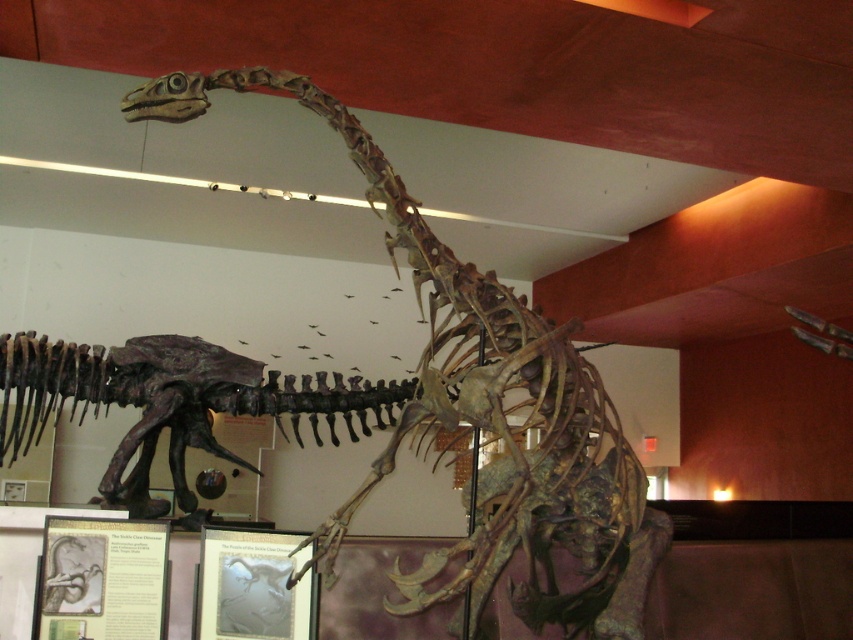
Can you confirm if brown bone-like dinosaur at center is positioned below shiny metallic dinosaur skeleton at center?

Incorrect, brown bone-like dinosaur at center is not positioned below shiny metallic dinosaur skeleton at center.

What do you see at coordinates (485, 413) in the screenshot? I see `brown bone-like dinosaur at center` at bounding box center [485, 413].

Find the location of a particular element. brown bone-like dinosaur at center is located at coordinates (485, 413).